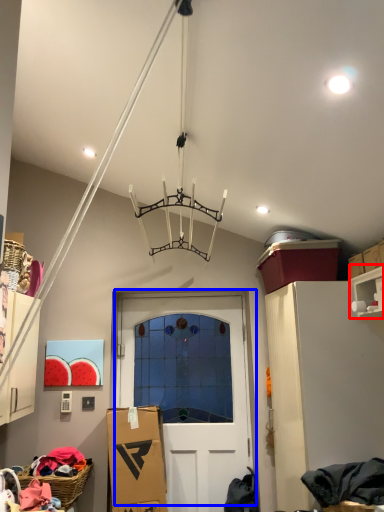
Question: Which object is further to the camera taking this photo, shelf (highlighted by a red box) or door (highlighted by a blue box)?

Choices:
 (A) shelf
 (B) door

Answer: (B)